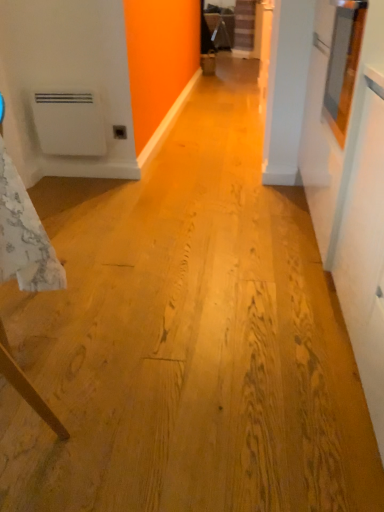
This screenshot has width=384, height=512. Identify the location of vacant space underneath white matte water heater at left (from a real-world perspective). (74, 175).